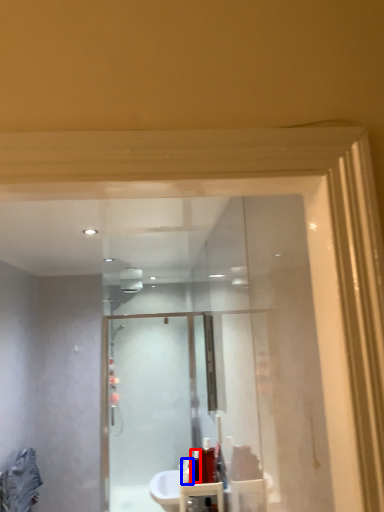
Question: Which point is closer to the camera, toiletry (highlighted by a red box) or toiletry (highlighted by a blue box)?

Choices:
 (A) toiletry
 (B) toiletry

Answer: (A)